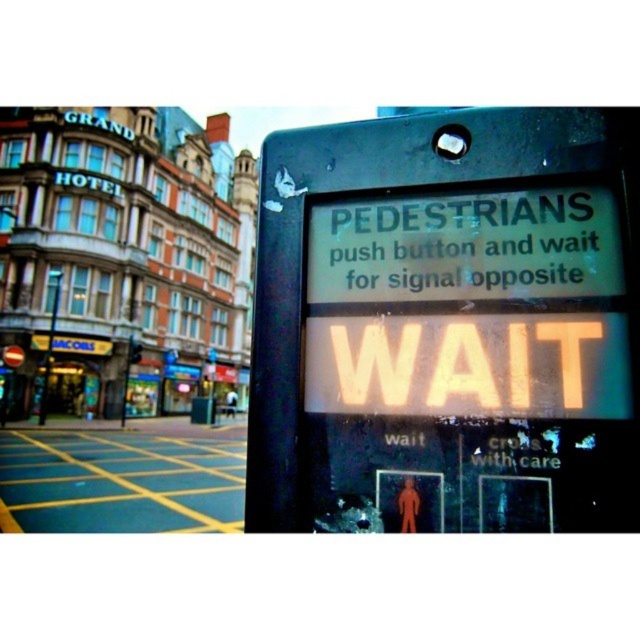
Question: Is black plastic pedestrian signal at center right behind black plastic pole at left?

Choices:
 (A) no
 (B) yes

Answer: (A)

Question: Is black plastic pedestrian signal at center right positioned before black plastic pole at left?

Choices:
 (A) yes
 (B) no

Answer: (A)

Question: Does black plastic pedestrian signal at center right lie behind black plastic pole at left?

Choices:
 (A) no
 (B) yes

Answer: (A)

Question: Among these points, which one is farthest from the camera?

Choices:
 (A) (573, 108)
 (B) (44, 412)

Answer: (B)

Question: Which point is farther from the camera taking this photo?

Choices:
 (A) (625, 424)
 (B) (60, 276)

Answer: (B)